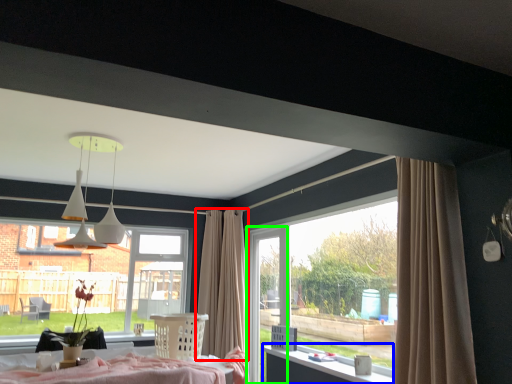
Question: Considering the real-world distances, which object is farthest from curtain (highlighted by a red box)? table (highlighted by a blue box) or screen door (highlighted by a green box)?

Choices:
 (A) table
 (B) screen door

Answer: (A)